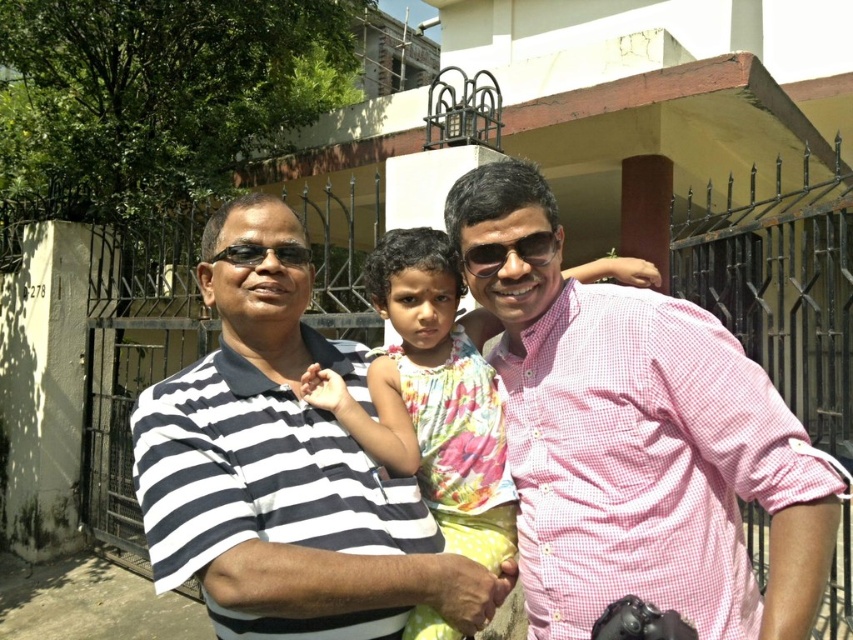
You are a photographer trying to capture a portrait of the two people in the scene. You notice the floral fabric dress at center and the black plastic sunglasses at center. Which object is located to the left of the other?

The floral fabric dress at center is positioned on the left side of black plastic sunglasses at center.

You are standing at the point marked by the coordinates point (x=283, y=472) in the image. What object is located exactly at this point?

The point (x=283, y=472) marks the striped cotton shirt at center.